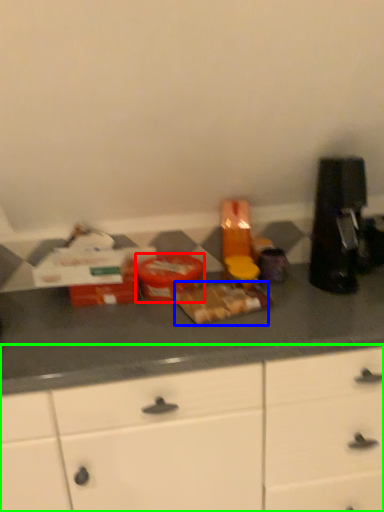
Question: Considering the real-world distances, which object is closest to food (highlighted by a red box)? food (highlighted by a blue box) or cabinetry (highlighted by a green box).

Choices:
 (A) food
 (B) cabinetry

Answer: (A)